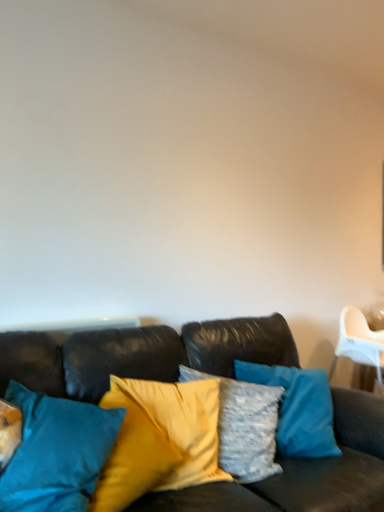
Question: Based on their positions, is teal fabric pillow at center, marked as the 1th pillow in a left-to-right arrangement, located to the left or right of leather couch at center?

Choices:
 (A) left
 (B) right

Answer: (A)

Question: Is teal fabric pillow at center, the second pillow in the right-to-left sequence, situated inside leather couch at center or outside?

Choices:
 (A) outside
 (B) inside

Answer: (B)

Question: Estimate the real-world distances between objects in this image. Which object is closer to the silky yellow pillow at center, the 2th pillow when ordered from left to right?

Choices:
 (A) teal fabric pillow at center, marked as the 1th pillow in a left-to-right arrangement
 (B) leather couch at center

Answer: (B)

Question: Which object is positioned closest to the teal fabric pillow at center, marked as the 1th pillow in a left-to-right arrangement?

Choices:
 (A) leather couch at center
 (B) silky yellow pillow at center, the 2th pillow when ordered from left to right

Answer: (A)